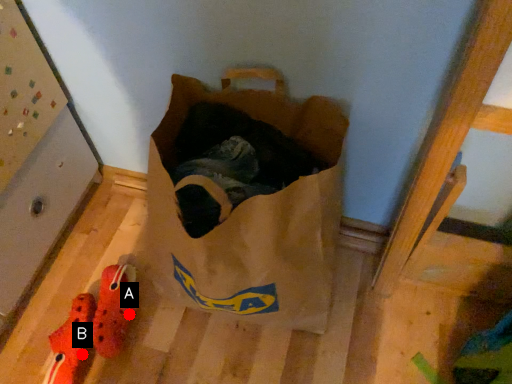
Question: Two points are circled on the image, labeled by A and B beside each circle. Which point is closer to the camera?

Choices:
 (A) A is closer
 (B) B is closer

Answer: (B)